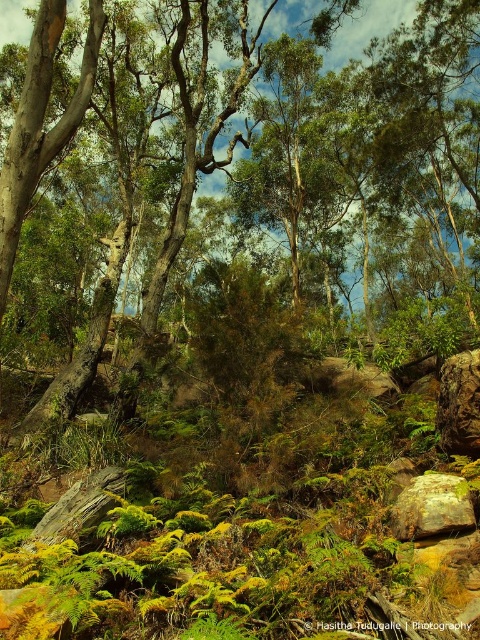
You are standing in the forest and want to locate the green leafy tree at center. According to the coordinates provided, where should you look?

The green leafy tree at center is located at coordinates point (375,125).

You are a hiker who wants to take a photo of both the green leafy tree at center and the rusty metallic rock at lower right. Which object should you focus on first if you want to include both in the same frame without moving your camera?

The green leafy tree at center has a larger width than the rusty metallic rock at lower right, so you should focus on the green leafy tree at center first to ensure it fits in the frame, then adjust to include the smaller rusty metallic rock at lower right.

You are a hiker who wants to take a photo of the rusty metallic rock at lower right without the green leafy tree at center blocking the view. Is there a way to move around the tree to get a clear shot?

The rusty metallic rock at lower right is behind the green leafy tree at center, so moving around the tree to the side or behind it might allow you to capture the rock without obstruction.